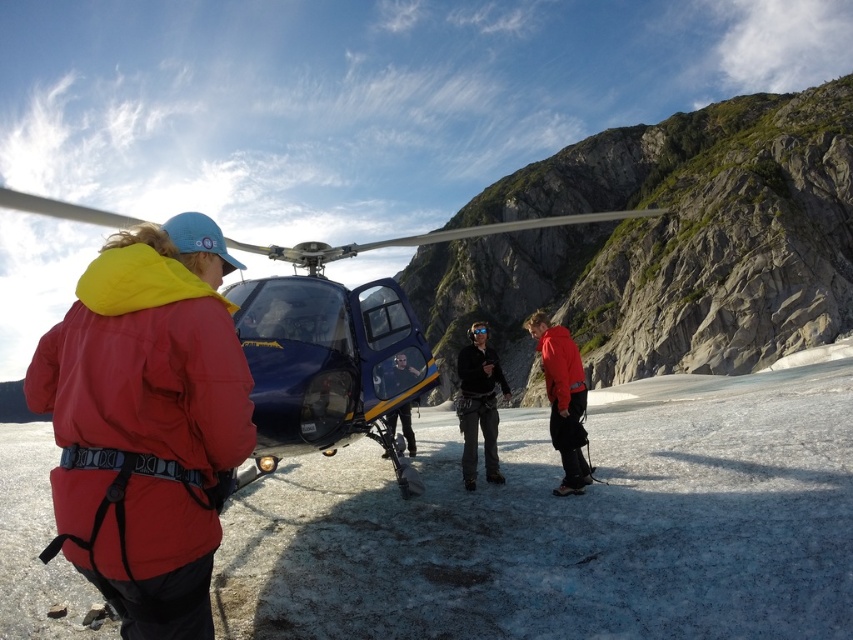
Question: Which of the following is the closest to the observer?

Choices:
 (A) red matte jacket at center
 (B) matte black helmet at center
 (C) black matte jacket at center
 (D) blue metallic helicopter at center

Answer: (D)

Question: Which object is positioned closest to the matte red jacket at left?

Choices:
 (A) black matte jacket at center
 (B) blue metallic helicopter at center
 (C) red matte jacket at center
 (D) matte black helmet at center

Answer: (D)

Question: In this image, where is matte red jacket at left located relative to black matte jacket at center?

Choices:
 (A) above
 (B) below

Answer: (A)

Question: Does matte red jacket at left have a lesser width compared to matte black helmet at center?

Choices:
 (A) no
 (B) yes

Answer: (A)

Question: Which object appears farthest from the camera in this image?

Choices:
 (A) matte black helmet at center
 (B) black matte jacket at center
 (C) matte red jacket at left

Answer: (B)

Question: Does matte red jacket at left have a greater width compared to black matte jacket at center?

Choices:
 (A) no
 (B) yes

Answer: (B)